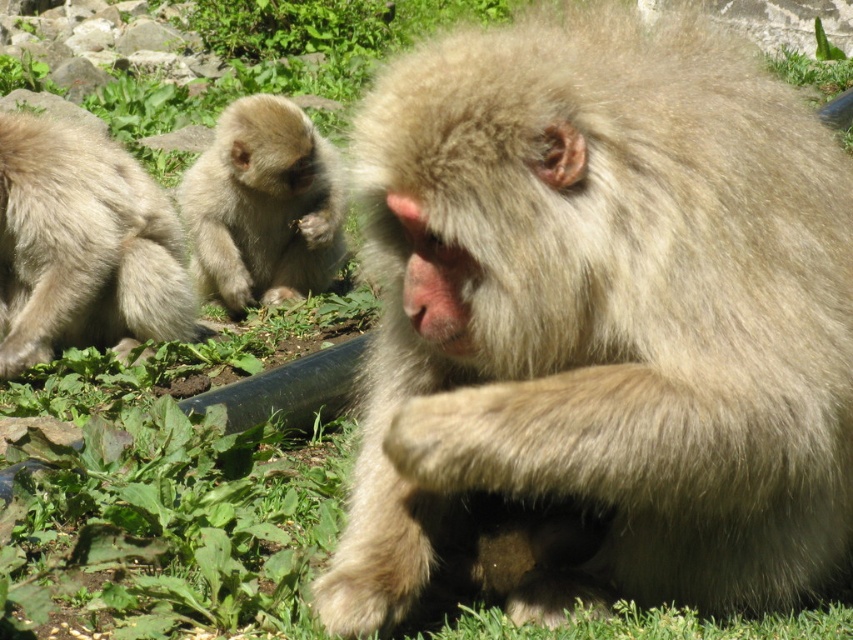
You are observing two fuzzy beige monkeys in an image. The monkeys are labeled as the fuzzy beige monkey at center and the fuzzy beige monkey at left. From your perspective, which monkey is positioned to the right side?

The fuzzy beige monkey at center is positioned to the right of the fuzzy beige monkey at left.

You are a wildlife photographer observing two fuzzy beige monkeys in a forest. You notice the fuzzy beige monkey at center and the fuzzy beige monkey at left. Based on their positions, which monkey is closer to the camera?

The fuzzy beige monkey at center is closer to the camera because it is located below the fuzzy beige monkey at left, indicating a lower position in the frame which typically corresponds to being nearer in such compositions.